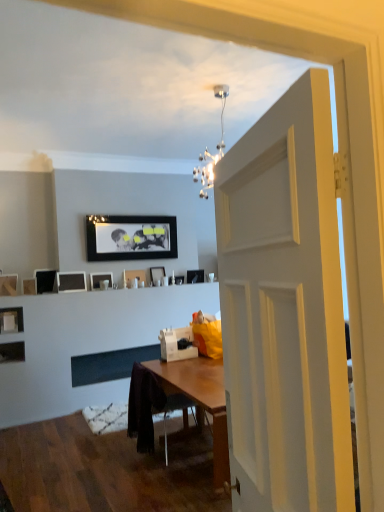
You are a GUI agent. You are given a task and a screenshot of the screen. Output one action in this format:
    pyautogui.click(x=<x>, y=<y>)
    Task: Click on the vacant region under wooden chair at center (from a real-world perspective)
    This screenshot has height=512, width=384.
    Given the screenshot: What is the action you would take?
    pyautogui.click(x=175, y=452)